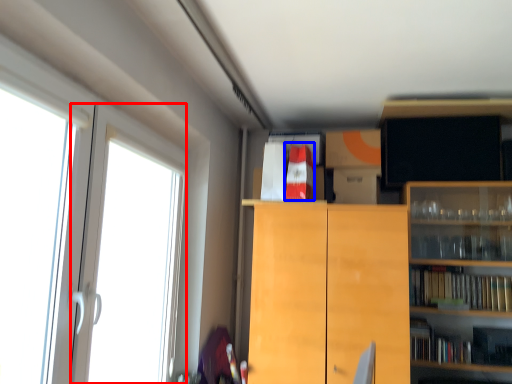
Question: Among these objects, which one is nearest to the camera, screen door (highlighted by a red box) or book (highlighted by a blue box)?

Choices:
 (A) screen door
 (B) book

Answer: (A)